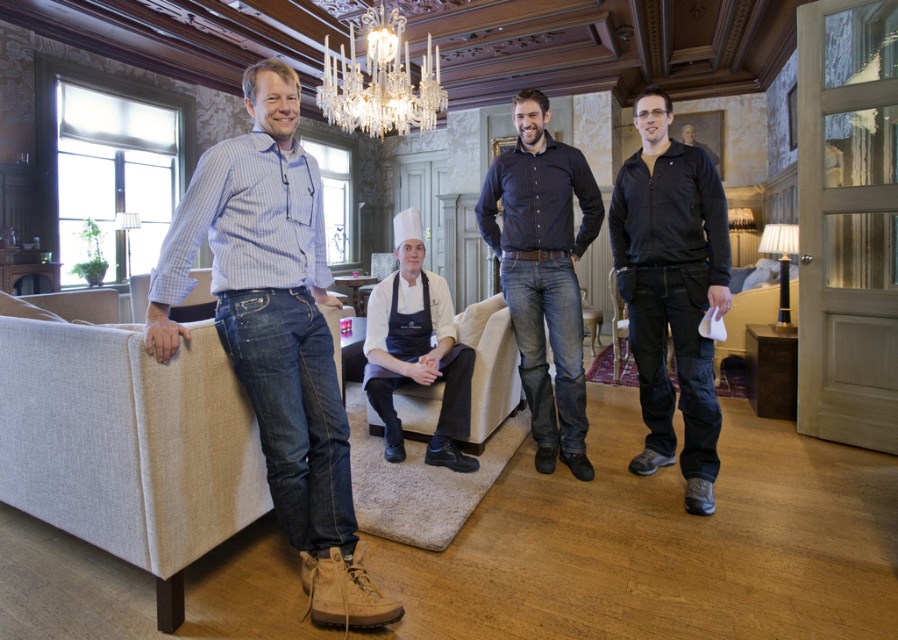
You are standing in the luxurious living room and want to place a small decorative item on one of two points marked in the scene. The points are labeled as point 1 at coordinates (644, 346) and point 2 at (592, 317). Considering the perspective from where you are standing, which point is closer to you?

Point 1 at coordinates (644, 346) is closer to the viewer than point 2 at (592, 317).

You are a photographer setting up a shoot in this luxurious living room. You need to position a 1.5 meter wide backdrop between the blue jeans at left and the black matte jacket at right. Will there be enough space to place the backdrop between them?

The distance between the blue jeans at left and the black matte jacket at right is 1.59 meters. Since the backdrop is 1.5 meters wide, there will be enough space to place it between them as the distance is slightly larger than the backdrop.

You are a photographer setting up a shoot in the living room. You need to ensure that the blue jeans at left and the black matte jacket at right are clearly visible in the frame. Given their sizes, which one might require more careful positioning to avoid being overshadowed?

The black matte jacket at right is smaller in size than the blue jeans at left, so it might require more careful positioning to ensure it is not overshadowed by the larger blue jeans at left.